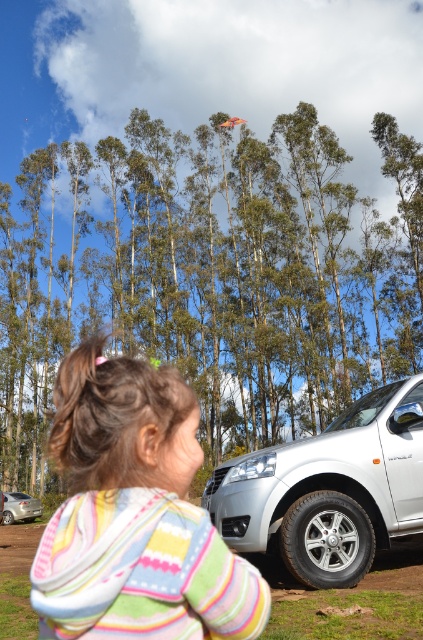
You are a delivery drone that needs to deliver a package to the silver metallic suv at lower right. You are currently hovering above the striped hoodie at lower left. What is the minimum distance you need to fly to reach the suv?

The minimum distance you need to fly is 4.71 meters, as the distance between the striped hoodie at lower left and the silver metallic suv at lower right is 4.71 meters.